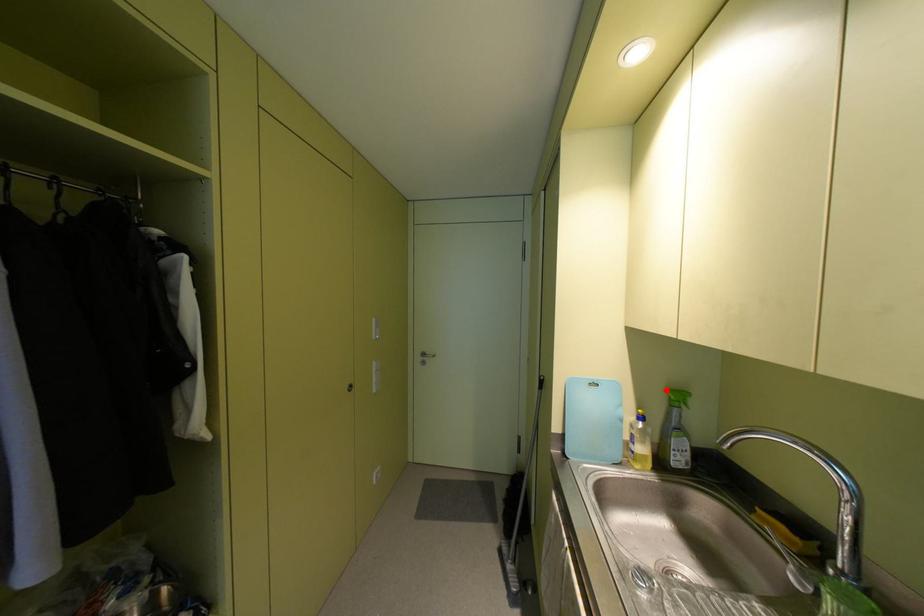
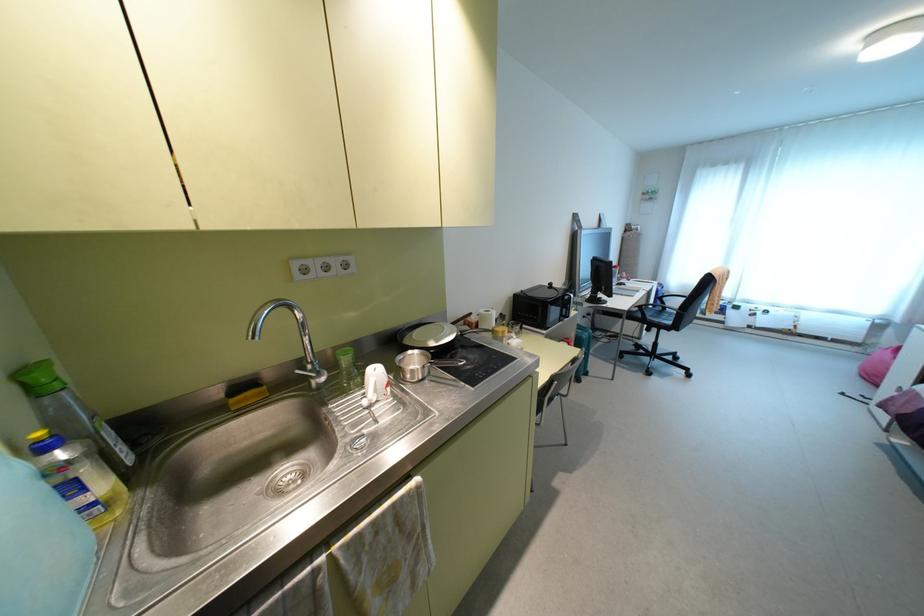
Where in the second image is the point corresponding to the highlighted location from the first image?

(20, 374)